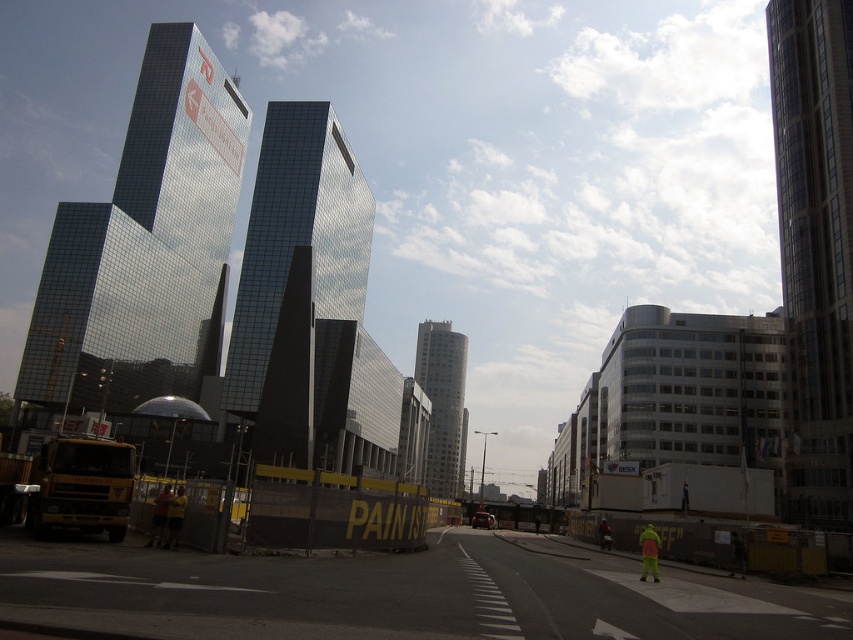
Question: Does shiny glass skyscraper at center have a lesser width compared to neon yellow reflective jacket at lower right?

Choices:
 (A) no
 (B) yes

Answer: (A)

Question: Which point appears closest to the camera in this image?

Choices:
 (A) (782, 236)
 (B) (646, 568)

Answer: (B)

Question: Which of these objects is positioned farthest from the shiny glass skyscraper at center?

Choices:
 (A) smooth glass tower at center
 (B) neon yellow reflective jacket at lower right
 (C) reflective glass skyscraper at center

Answer: (B)

Question: Which of these objects is positioned farthest from the reflective glass skyscraper at center?

Choices:
 (A) shiny glass skyscraper at center
 (B) neon yellow reflective jacket at lower right
 (C) smooth glass tower at center
 (D) glassy reflective skyscraper at right

Answer: (B)

Question: Does reflective glass skyscraper at center have a lesser width compared to neon yellow reflective jacket at lower right?

Choices:
 (A) yes
 (B) no

Answer: (B)

Question: Is shiny glass skyscraper at center to the right of neon yellow reflective jacket at lower right from the viewer's perspective?

Choices:
 (A) yes
 (B) no

Answer: (B)